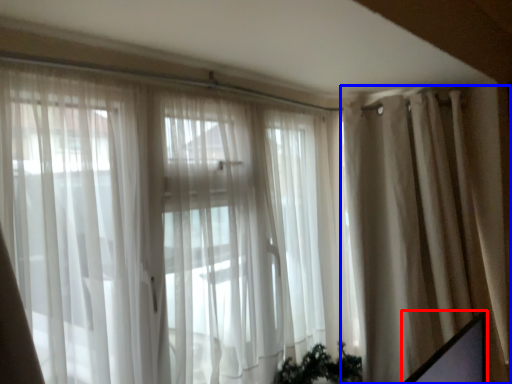
Question: Which of the following is the closest to the observer, computer screen (highlighted by a red box) or curtain (highlighted by a blue box)?

Choices:
 (A) computer screen
 (B) curtain

Answer: (A)